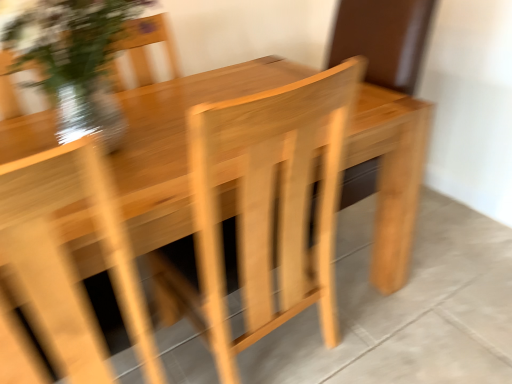
The width and height of the screenshot is (512, 384). I want to click on vacant space behind translucent glass vase at upper left, so [160, 103].